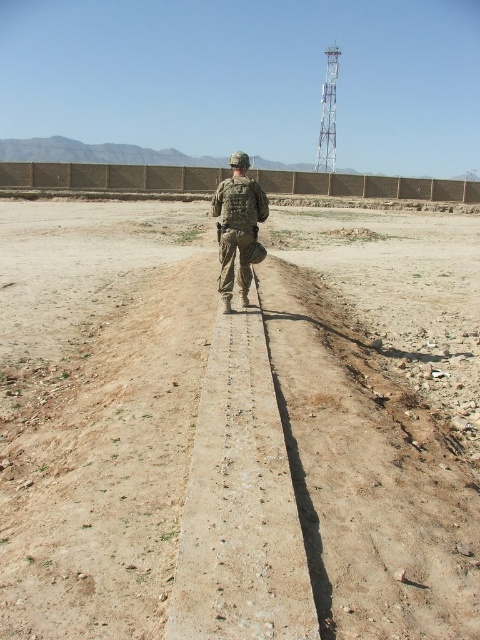
You are a photographer positioned at the starting point of the path. You want to capture a photo where the dusty brown dirt at center is in focus while keeping the camouflage fabric uniform at center blurred in the background. Is this possible given their positions?

The dusty brown dirt at center is closer to the viewer than the camouflage fabric uniform at center. By focusing on the dusty brown dirt at center and using a shallow depth of field, the camouflage fabric uniform at center would naturally appear blurred in the background.

You are a drone operator observing the soldier in the scene. Your drone has a maximum flight range of 3 meters. Can the drone reach the dusty brown dirt at center from the camouflage fabric uniform at center where the soldier is standing?

The dusty brown dirt at center is 3.33 meters away from the camouflage fabric uniform at center. Since the drone has a maximum flight range of 3 meters, it cannot reach the dusty brown dirt at center from the camouflage fabric uniform at center.

You are a drone operator observing the soldier in the scene. Your task is to determine if the dusty brown dirt at center is visible below the camouflage fabric uniform at center. Based on the scene description, can you confirm this?

Yes, the dusty brown dirt at center is visible below the camouflage fabric uniform at center as stated in the description.